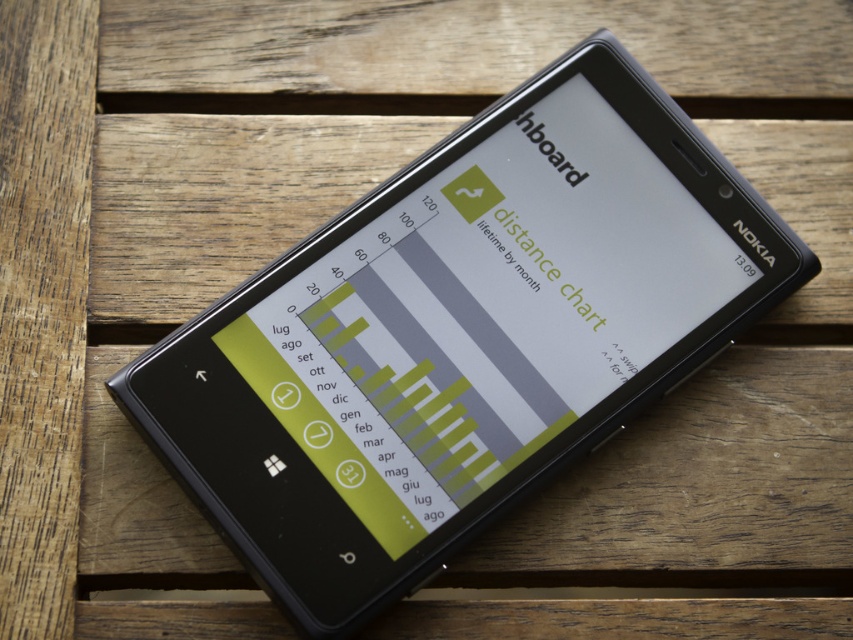
You are holding a phone and looking at the distance chart displayed on it. The chart has a green and gray color scheme. You notice the matte black phone at center and the green matte text at center. Which object is closer to your eyes?

The matte black phone at center is closer to the viewer than the green matte text at center, so the phone is closer to your eyes.

Based on the photo, you are holding a phone and looking at the screen. You notice the matte black phone at center and the green matte text at center. Which object is taller?

The matte black phone at center is taller than the green matte text at center.